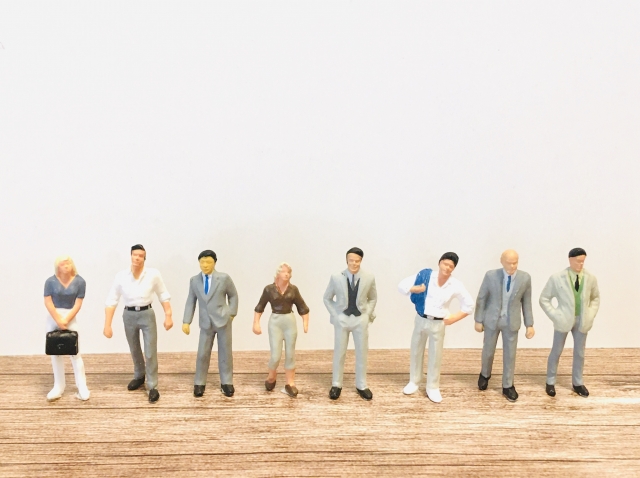
Find the location of `figurines wearing pants`. figurines wearing pants is located at coordinates (56, 378), (144, 356), (220, 356), (360, 360), (440, 359), (511, 354), (555, 355).